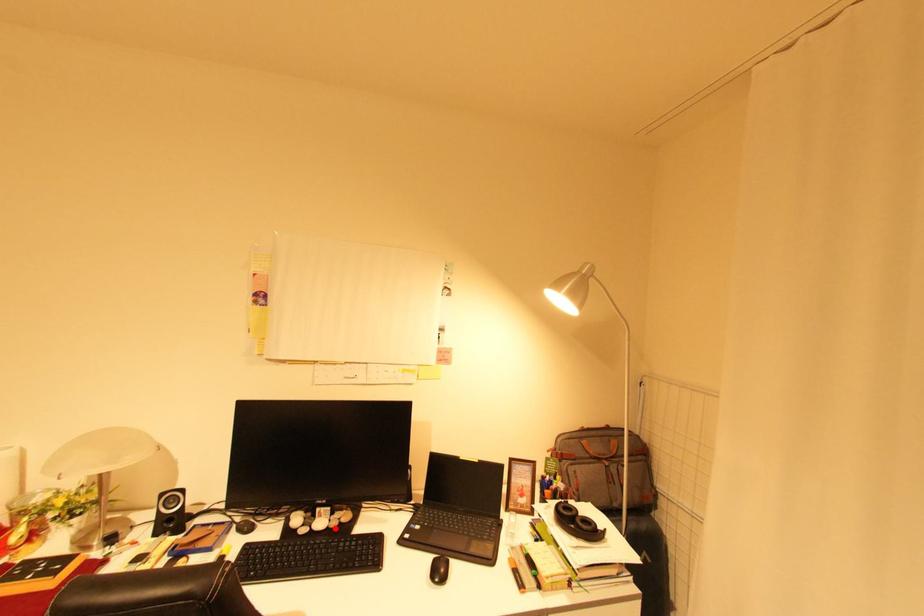
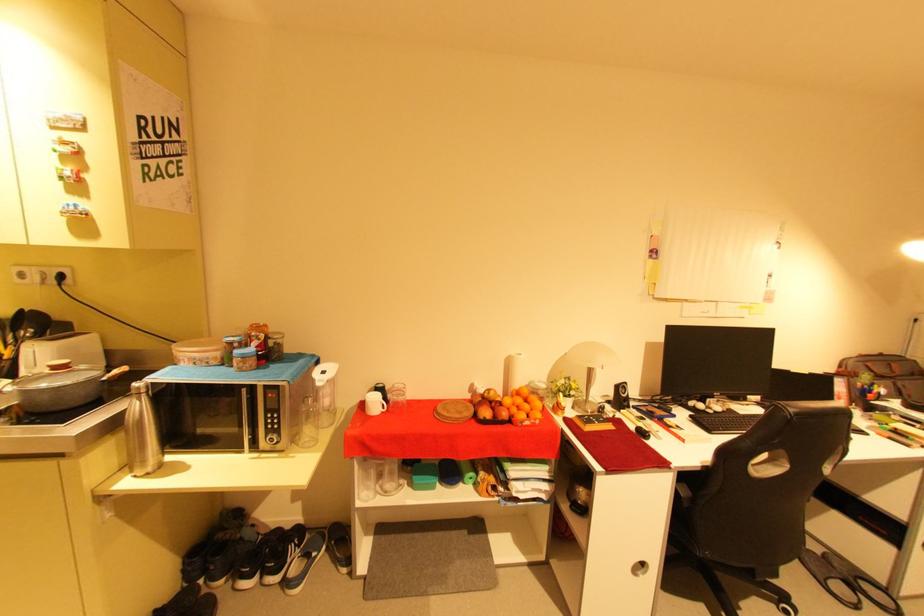
Locate, in the second image, the point that corresponds to the highlighted location in the first image.

(730, 411)